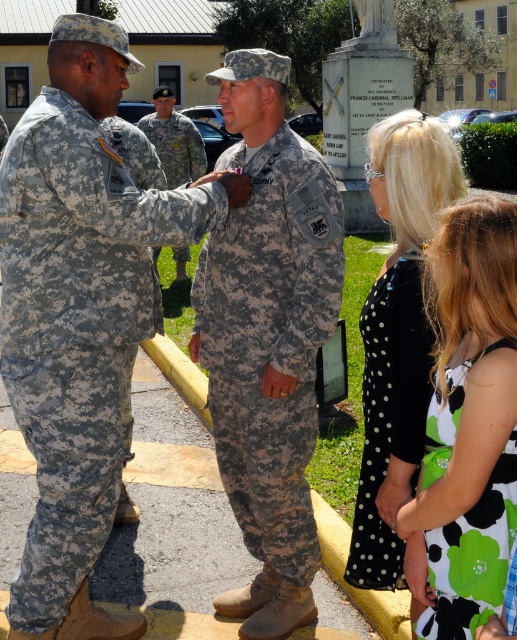
Between camouflage fabric uniform at left and green floral dress at center, which one appears on the right side from the viewer's perspective?

green floral dress at center

Does camouflage fabric uniform at left have a greater height compared to green floral dress at center?

Yes.

This screenshot has width=517, height=640. Find the location of `camouflage fabric uniform at left`. camouflage fabric uniform at left is located at coordinates (77, 328).

From the picture: Is camouflage fabric uniform at center closer to camera compared to green floral dress at center?

No, camouflage fabric uniform at center is further to the viewer.

What do you see at coordinates (270, 342) in the screenshot? The height and width of the screenshot is (640, 517). I see `camouflage fabric uniform at center` at bounding box center [270, 342].

I want to click on camouflage fabric uniform at center, so click(270, 342).

Between camouflage fabric uniform at left and camouflage fabric uniform at center, which one is positioned lower?

camouflage fabric uniform at center

Is camouflage fabric uniform at left smaller than camouflage fabric uniform at center?

Actually, camouflage fabric uniform at left might be larger than camouflage fabric uniform at center.

Which is behind, point (97, 236) or point (293, 532)?

The point (293, 532) is more distant.

Identify the location of camouflage fabric uniform at left. This screenshot has height=640, width=517. (77, 328).